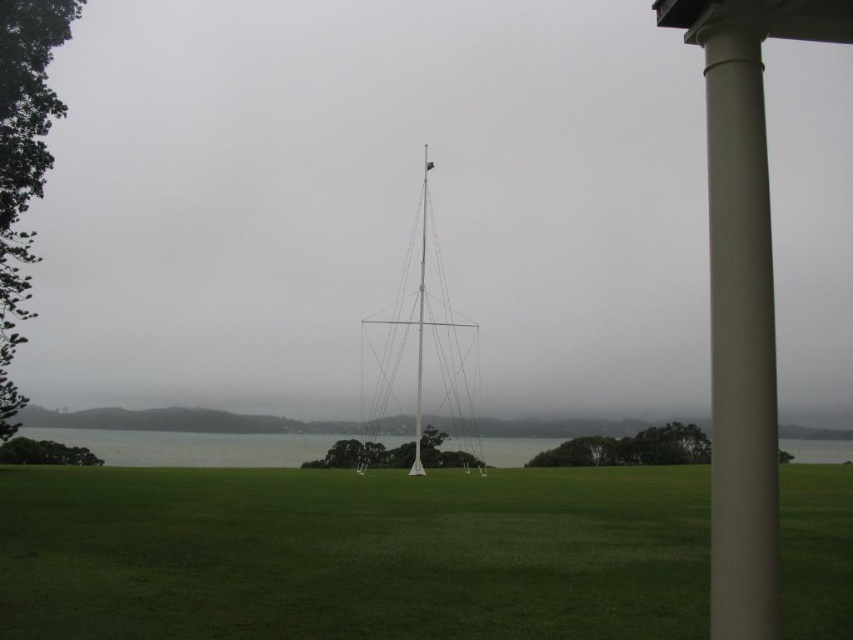
Question: Considering the real-world distances, which object is closest to the white metallic flag pole at center?

Choices:
 (A) satin beige column at right
 (B) green grass at center
 (C) white metallic sailboat at center

Answer: (C)

Question: Which of the following is the farthest from the observer?

Choices:
 (A) (746, 176)
 (B) (474, 433)
 (C) (418, 323)

Answer: (B)

Question: Considering the relative positions of white metallic sailboat at center and white metallic flag pole at center in the image provided, where is white metallic sailboat at center located with respect to white metallic flag pole at center?

Choices:
 (A) above
 (B) below

Answer: (B)

Question: Is green grass at center below white metallic flag pole at center?

Choices:
 (A) yes
 (B) no

Answer: (A)

Question: Among these objects, which one is nearest to the camera?

Choices:
 (A) green grass at center
 (B) white metallic flag pole at center
 (C) satin beige column at right
 (D) white metallic sailboat at center

Answer: (A)

Question: Is satin beige column at right in front of white metallic sailboat at center?

Choices:
 (A) no
 (B) yes

Answer: (B)